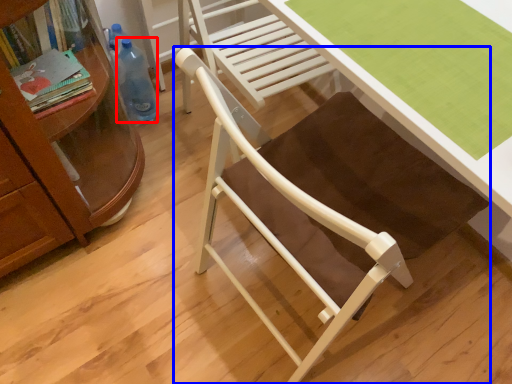
Question: Which object is further to the camera taking this photo, bottle (highlighted by a red box) or chair (highlighted by a blue box)?

Choices:
 (A) bottle
 (B) chair

Answer: (A)